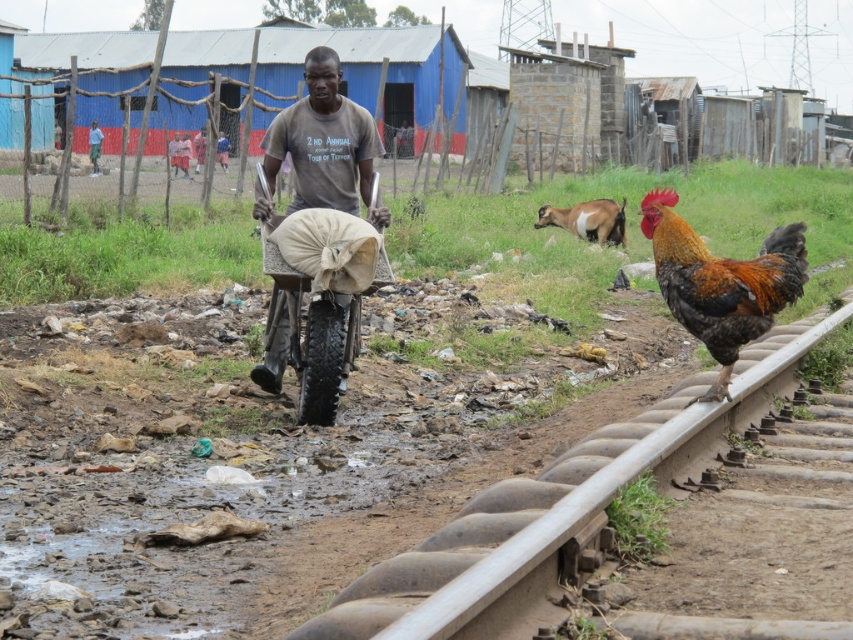
Does brown cotton shirt at center have a lesser width compared to brown and white fur goat at center?

Correct, brown cotton shirt at center's width is less than brown and white fur goat at center's.

You are a GUI agent. You are given a task and a screenshot of the screen. Output one action in this format:
    pyautogui.click(x=<x>, y=<y>)
    Task: Click on the brown cotton shirt at center
    
    Given the screenshot: What is the action you would take?
    pyautogui.click(x=320, y=145)

Is the position of brown metal rail at right more distant than that of brown cotton shirt at center?

That is False.

Who is higher up, brown metal rail at right or brown cotton shirt at center?

brown cotton shirt at center is higher up.

What do you see at coordinates (553, 504) in the screenshot? Image resolution: width=853 pixels, height=640 pixels. I see `brown metal rail at right` at bounding box center [553, 504].

Locate an element on the screen. brown metal rail at right is located at coordinates (553, 504).

Which is above, brown metal rail at right or multicolored feathered rooster at right?

multicolored feathered rooster at right

Is point (795, 346) more distant than point (734, 337)?

Yes, point (795, 346) is farther from viewer.

You are a GUI agent. You are given a task and a screenshot of the screen. Output one action in this format:
    pyautogui.click(x=<x>, y=<y>)
    Task: Click on the brown metal rail at right
    The width and height of the screenshot is (853, 640).
    Given the screenshot: What is the action you would take?
    pyautogui.click(x=553, y=504)